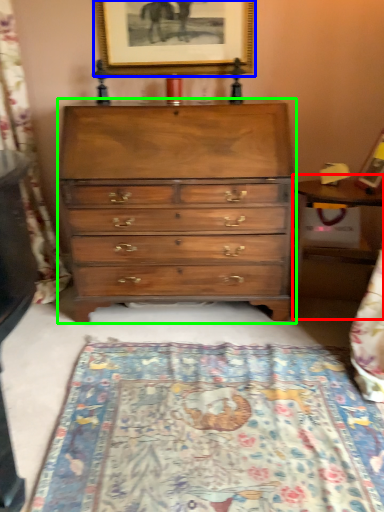
Question: Which object is positioned farthest from table (highlighted by a red box)? Select from picture frame (highlighted by a blue box) and chest of drawers (highlighted by a green box).

Choices:
 (A) picture frame
 (B) chest of drawers

Answer: (A)